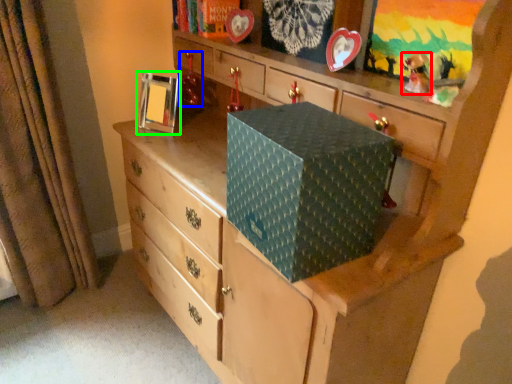
Question: Estimate the real-world distances between objects in this image. Which object is closer to toy (highlighted by a red box), toy (highlighted by a blue box) or picture frame (highlighted by a green box)?

Choices:
 (A) toy
 (B) picture frame

Answer: (A)